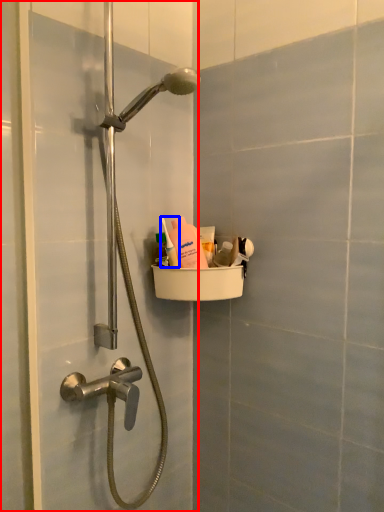
Question: Which point is closer to the camera, screen door (highlighted by a red box) or toiletry (highlighted by a blue box)?

Choices:
 (A) screen door
 (B) toiletry

Answer: (A)